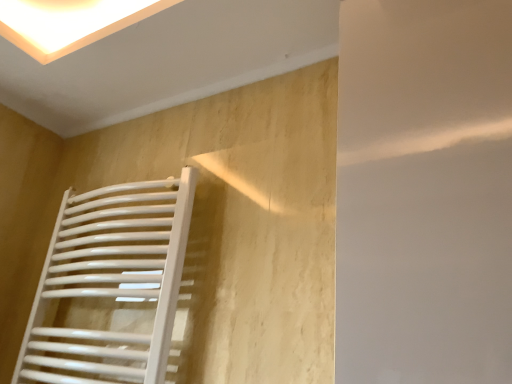
This screenshot has height=384, width=512. What do you see at coordinates (110, 285) in the screenshot? I see `white matte radiator at lower left` at bounding box center [110, 285].

The image size is (512, 384). In order to click on white matte radiator at lower left in this screenshot , I will do `click(110, 285)`.

The height and width of the screenshot is (384, 512). I want to click on white matte radiator at lower left, so tap(110, 285).